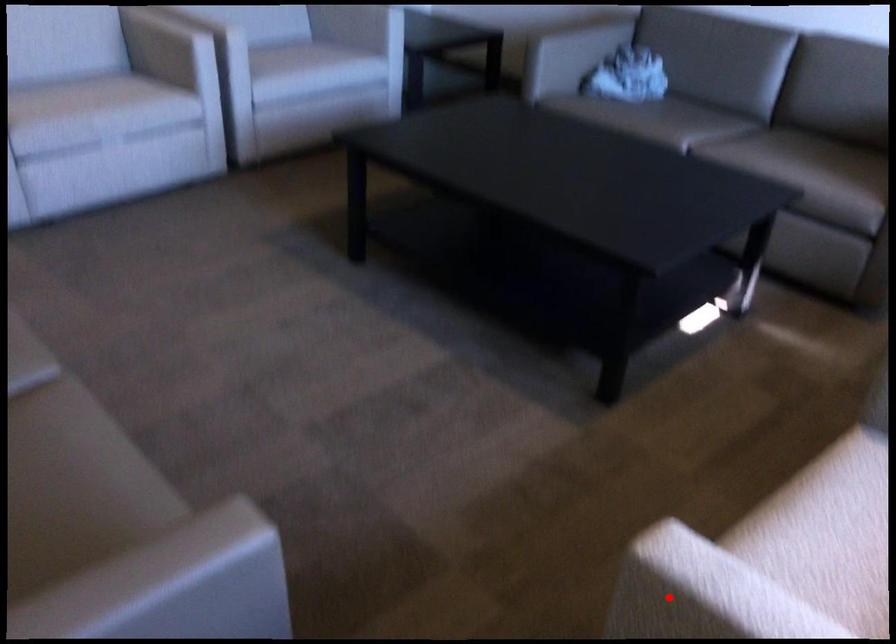
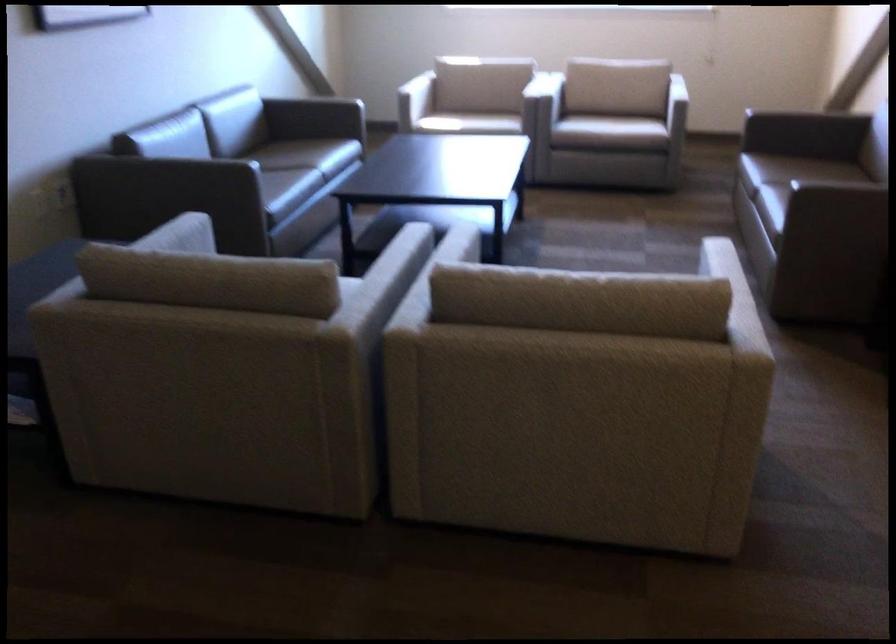
Question: I am providing you with two images of the same scene from different viewpoints. A red point is marked on the first image. At the location where the point appears in image 1, is it still visible in image 2?

Choices:
 (A) Yes
 (B) No

Answer: (B)